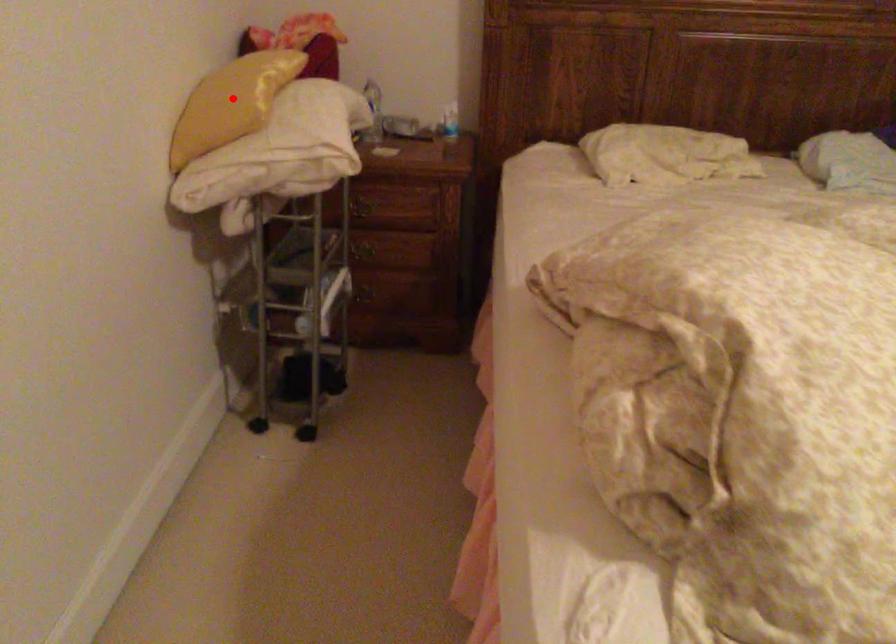
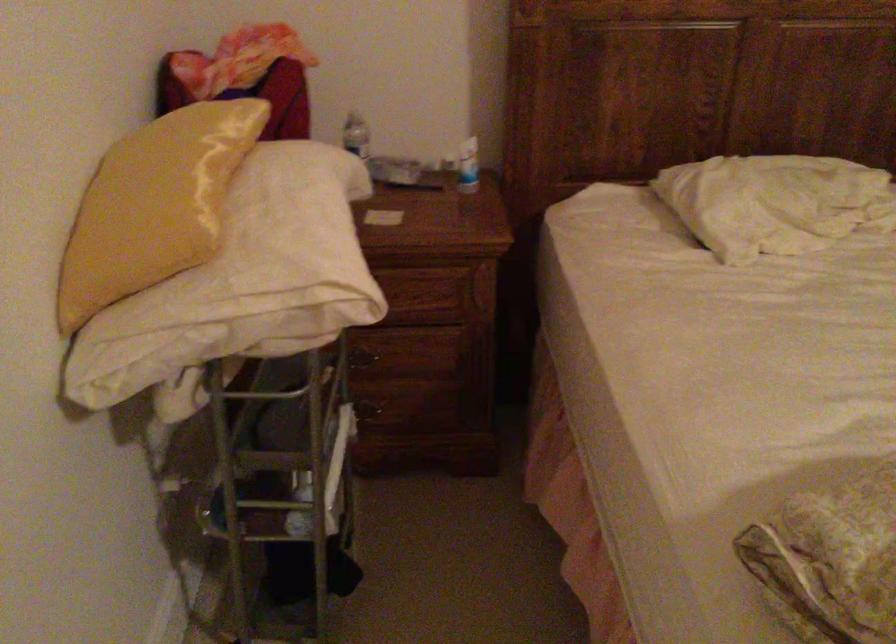
In the second image, find the point that corresponds to the highlighted location in the first image.

(153, 205)